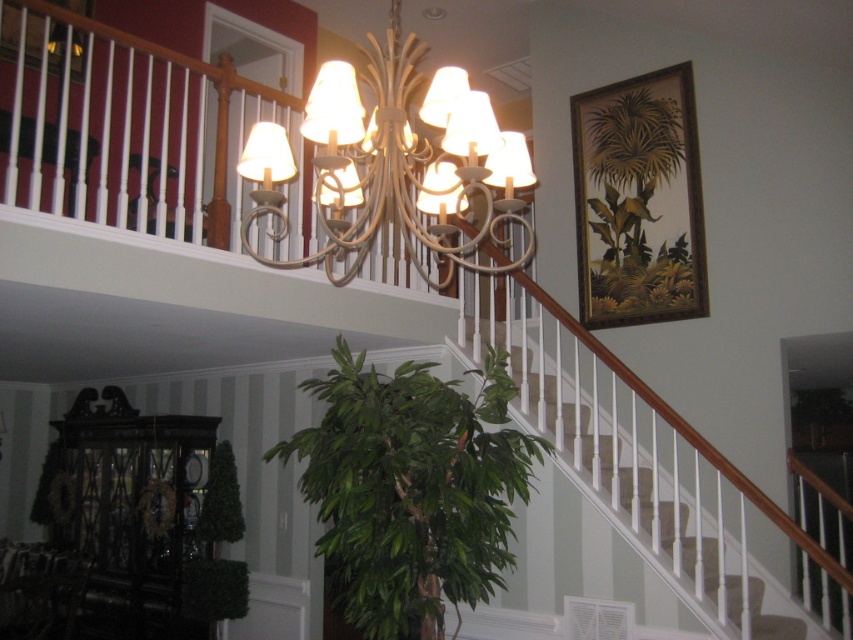
Which of these two, white textured stairs at center or wooden picture frame at upper left, stands taller?

white textured stairs at center

Between point (788, 561) and point (64, 28), which one is positioned behind?

The point (64, 28) is behind.

The height and width of the screenshot is (640, 853). I want to click on white textured stairs at center, so click(653, 481).

Who is higher up, green leafy plant at center or wooden picture frame at upper left?

wooden picture frame at upper left is higher up.

The image size is (853, 640). What are the coordinates of `green leafy plant at center` in the screenshot? It's located at (410, 490).

Is green leafy plant at center above wooden framed painting at upper right?

Incorrect, green leafy plant at center is not positioned above wooden framed painting at upper right.

Which of these two, green leafy plant at center or wooden framed painting at upper right, stands shorter?

With less height is wooden framed painting at upper right.

Does point (476, 572) lie in front of point (625, 164)?

Yes, it is.

The width and height of the screenshot is (853, 640). What are the coordinates of `green leafy plant at center` in the screenshot? It's located at (410, 490).